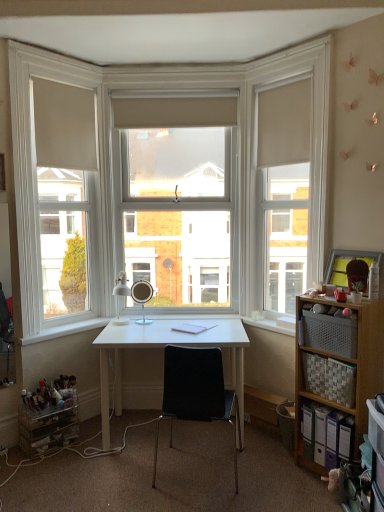
Identify the location of vacant space underneath white matte window frame at left, marked as the 2th window frame in a right-to-left arrangement (from a real-world perspective). The width and height of the screenshot is (384, 512). (70, 326).